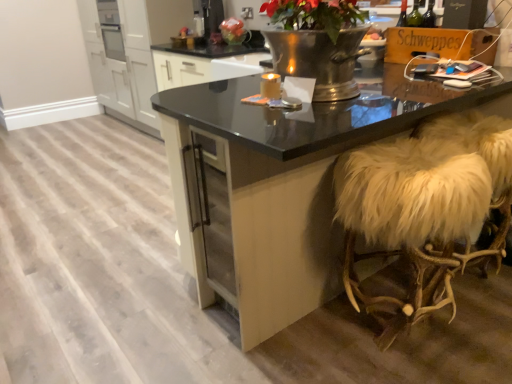
Question: Is the surface of white fur-covered stool at right in direct contact with matte plastic bag at upper center?

Choices:
 (A) no
 (B) yes

Answer: (A)

Question: From a real-world perspective, is white fur-covered stool at right below matte plastic bag at upper center?

Choices:
 (A) yes
 (B) no

Answer: (A)

Question: Is white fur-covered stool at right looking in the opposite direction of matte plastic bag at upper center?

Choices:
 (A) no
 (B) yes

Answer: (A)

Question: Is white fur-covered stool at right not close to matte plastic bag at upper center?

Choices:
 (A) no
 (B) yes

Answer: (B)

Question: Is white fur-covered stool at right closer to camera compared to matte plastic bag at upper center?

Choices:
 (A) no
 (B) yes

Answer: (B)

Question: Considering the positions of white fur-covered stool at right and matte gold candle at center in the image, is white fur-covered stool at right taller or shorter than matte gold candle at center?

Choices:
 (A) short
 (B) tall

Answer: (B)

Question: Looking at their shapes, would you say white fur-covered stool at right is wider or thinner than matte gold candle at center?

Choices:
 (A) wide
 (B) thin

Answer: (A)

Question: From the image's perspective, is white fur-covered stool at right located above or below matte gold candle at center?

Choices:
 (A) above
 (B) below

Answer: (B)

Question: Is white fur-covered stool at right in front of or behind matte gold candle at center in the image?

Choices:
 (A) behind
 (B) front

Answer: (B)

Question: Looking at their shapes, would you say black glossy table at center is wider or thinner than matte plastic bag at upper center?

Choices:
 (A) thin
 (B) wide

Answer: (B)

Question: Is point (186, 125) positioned closer to the camera than point (231, 26)?

Choices:
 (A) farther
 (B) closer

Answer: (B)

Question: Looking at the image, does black glossy table at center seem bigger or smaller compared to matte plastic bag at upper center?

Choices:
 (A) small
 (B) big

Answer: (B)

Question: Is black glossy table at center in front of or behind matte plastic bag at upper center in the image?

Choices:
 (A) behind
 (B) front

Answer: (B)

Question: In terms of width, does white fur-covered stool at right look wider or thinner when compared to black glossy table at center?

Choices:
 (A) wide
 (B) thin

Answer: (B)

Question: Choose the correct answer: Is white fur-covered stool at right inside black glossy table at center or outside it?

Choices:
 (A) inside
 (B) outside

Answer: (A)